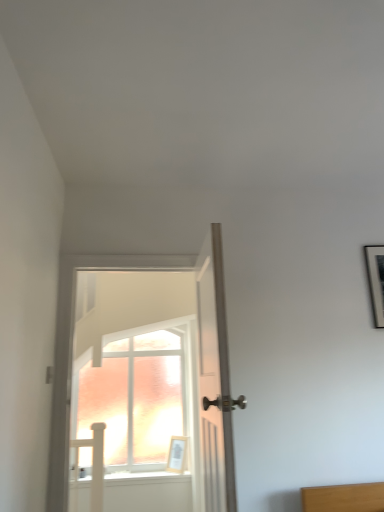
Question: Is white glossy door at center, acting as the 1th door starting from the left, situated inside light wood picture frame at center or outside?

Choices:
 (A) inside
 (B) outside

Answer: (B)

Question: From the image's perspective, relative to light wood picture frame at center, is white glossy door at center, the second door when ordered from right to left, above or below?

Choices:
 (A) below
 (B) above

Answer: (B)

Question: Which object is positioned farthest from the white glossy door at center, acting as the 1th door starting from the left?

Choices:
 (A) white wooden door at center, which is the 1th door from right to left
 (B) light wood picture frame at center

Answer: (A)

Question: Estimate the real-world distances between objects in this image. Which object is farther from the white wooden door at center, the second door positioned from the left?

Choices:
 (A) light wood picture frame at center
 (B) white glossy door at center, acting as the 1th door starting from the left

Answer: (B)